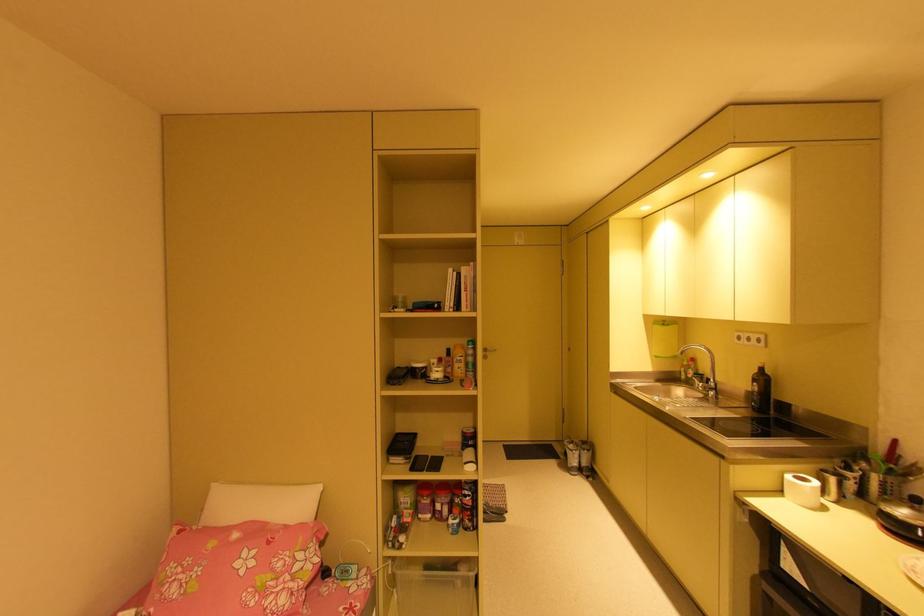
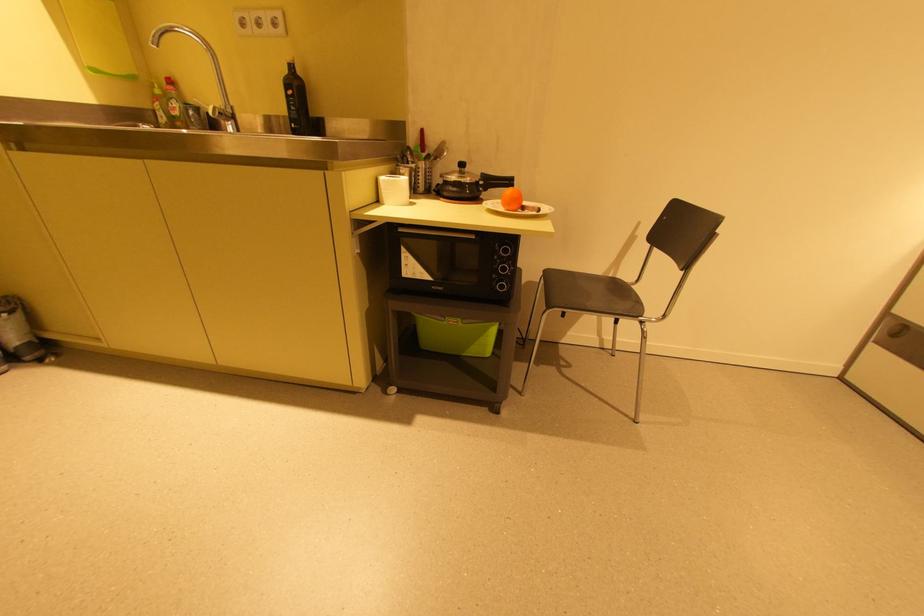
Question: I am providing you with two images of the same scene from different viewpoints. Please identify which objects are invisible in image2.

Choices:
 (A) red spatula handle
 (B) chair sitting surface
 (C) white paper towel
 (D) none of these

Answer: (D)